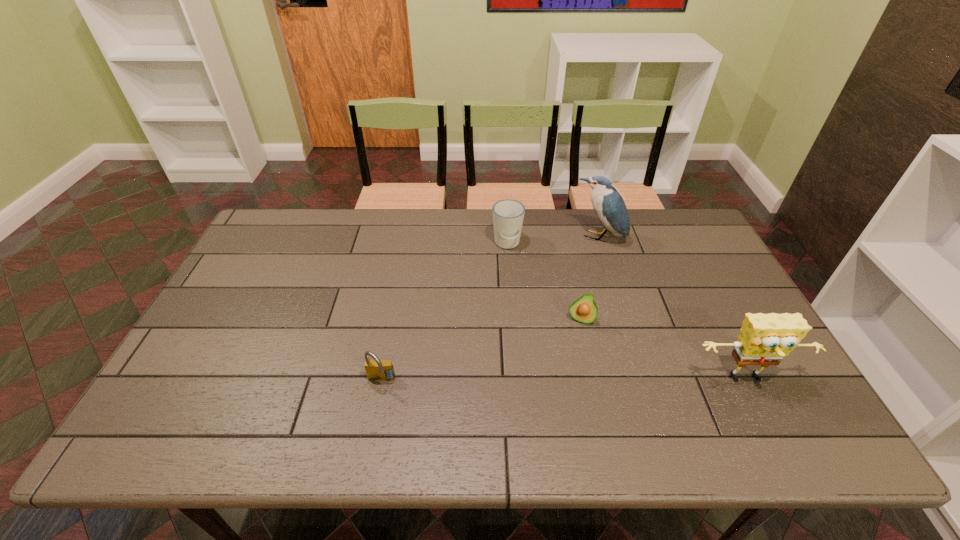
At what (x,y) coordinates should I click in order to perform the action: click on vacant point located 0.380m with a handle on the side of the fourth object from right to left. Please return your answer as a coordinate pair (x, y). Looking at the image, I should click on (509, 349).

Locate an element on the screen. vacant space located with a handle on the side of the fourth object from right to left is located at coordinates tap(508, 268).

Image resolution: width=960 pixels, height=540 pixels. Find the location of `vacant space positioned on the cut side of the third farthest object`. vacant space positioned on the cut side of the third farthest object is located at coordinates (572, 348).

Where is `free space located on the cut side of the third farthest object`? free space located on the cut side of the third farthest object is located at coordinates (561, 395).

Locate an element on the screen. vacant space located 0.080m on the cut side of the third farthest object is located at coordinates (572, 348).

I want to click on bird that is at the far edge, so click(608, 204).

Find the location of a particular element. cup that is at the far edge is located at coordinates (508, 215).

Where is `padlock located in the near edge section of the desktop`? padlock located in the near edge section of the desktop is located at coordinates (376, 369).

The image size is (960, 540). I want to click on sponge that is at the near edge, so click(x=764, y=339).

Find the location of a particular element. object at the right edge is located at coordinates (764, 339).